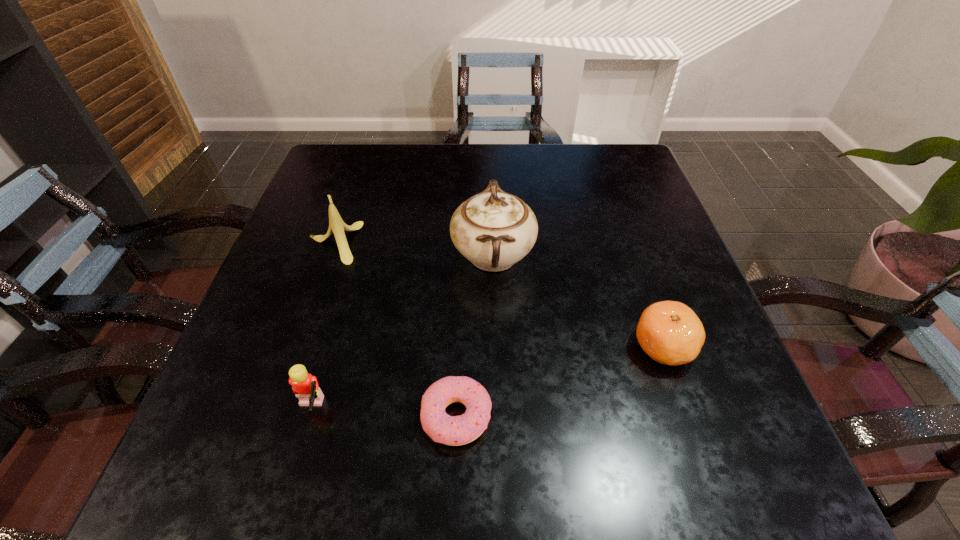
The height and width of the screenshot is (540, 960). What are the coordinates of `vacant region at the far right corner of the desktop` in the screenshot? It's located at (628, 154).

I want to click on free space at the near right corner of the desktop, so click(753, 454).

Find the location of a particular element. unoccupied position between the banana and the clementine is located at coordinates (498, 294).

This screenshot has width=960, height=540. I want to click on empty location between the chinaware and the shortest object, so click(x=475, y=336).

The image size is (960, 540). What are the coordinates of `free space between the Lego and the banana` in the screenshot? It's located at (322, 326).

I want to click on free space that is in between the Lego and the doughnut, so click(384, 414).

You are a GUI agent. You are given a task and a screenshot of the screen. Output one action in this format:
    pyautogui.click(x=<x>, y=<y>)
    Task: Click on the vacant space that's between the tallest object and the shortest object
    
    Given the screenshot: What is the action you would take?
    pyautogui.click(x=475, y=336)

Where is `free space between the banana and the Lego`? This screenshot has height=540, width=960. free space between the banana and the Lego is located at coordinates (322, 326).

The width and height of the screenshot is (960, 540). Identify the location of free space between the third farthest object and the shortest object. (560, 382).

You are a GUI agent. You are given a task and a screenshot of the screen. Output one action in this format:
    pyautogui.click(x=<x>, y=<y>)
    Task: Click on the free space between the Lego and the banana
    This screenshot has width=960, height=540.
    Given the screenshot: What is the action you would take?
    pyautogui.click(x=322, y=326)